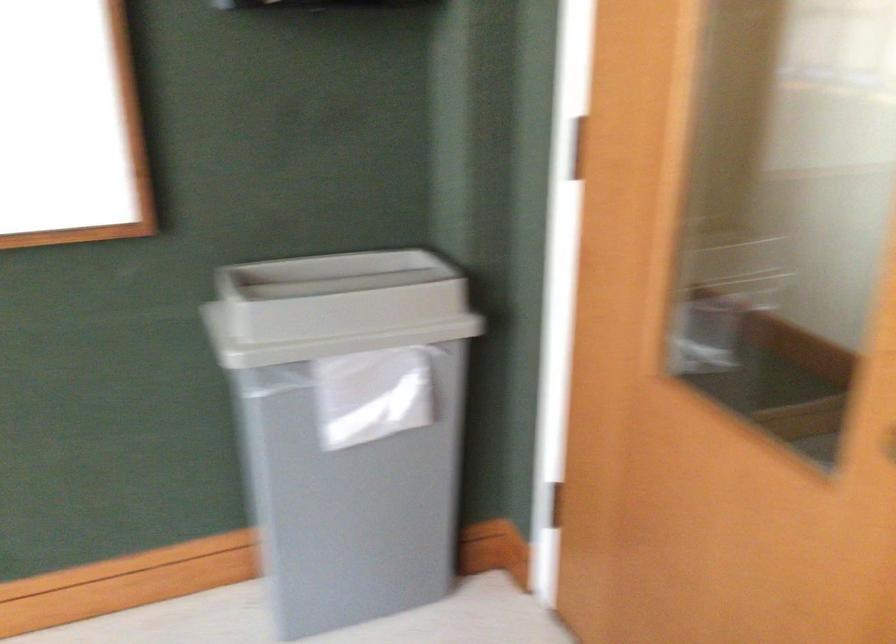
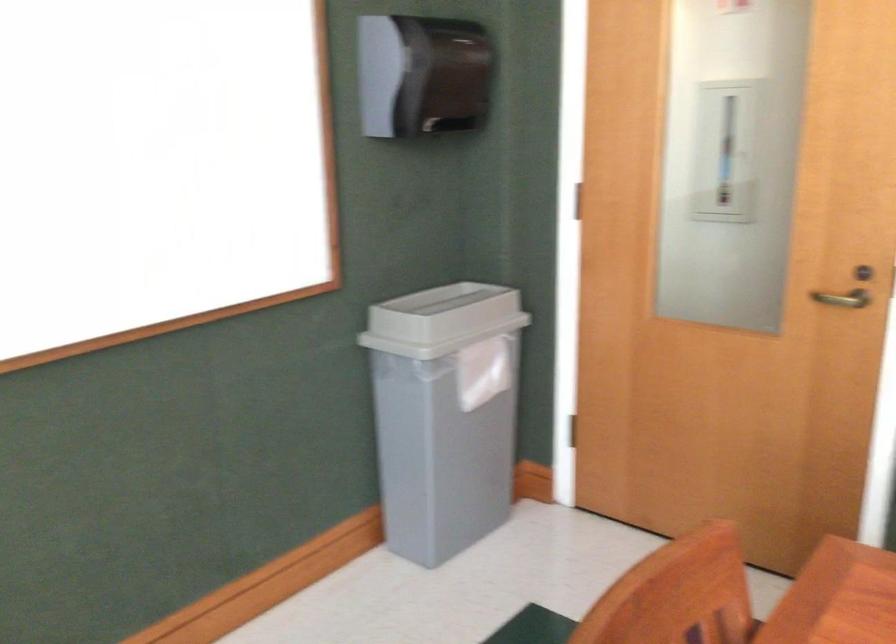
In a continuous first-person perspective shot, in which direction is the camera moving?

The movement direction of the cameraman is left, backward.